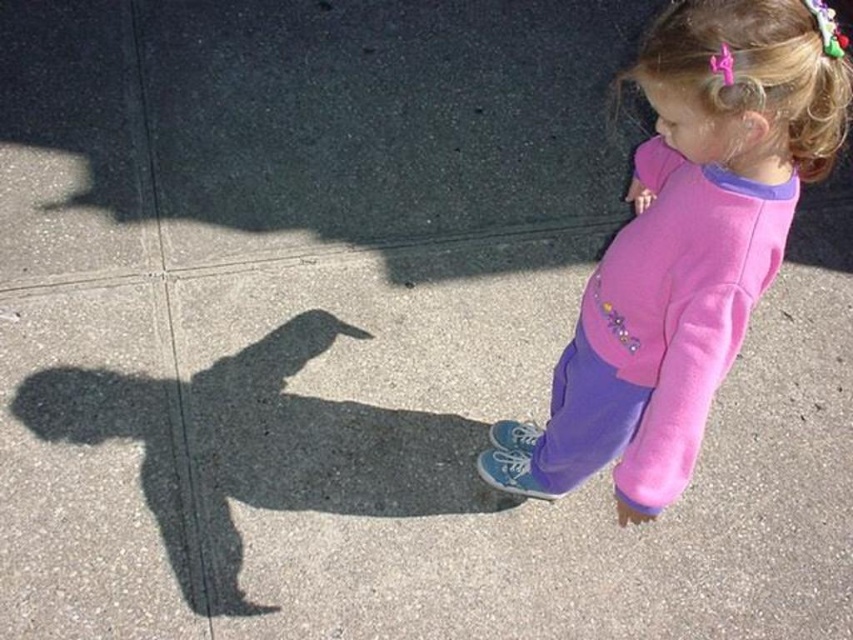
Can you confirm if pink fleece sweatshirt at center is thinner than pink hair clip at upper right?

In fact, pink fleece sweatshirt at center might be wider than pink hair clip at upper right.

Can you confirm if pink fleece sweatshirt at center is wider than pink hair clip at upper right?

Correct, the width of pink fleece sweatshirt at center exceeds that of pink hair clip at upper right.

Find the location of a particular element. This screenshot has height=640, width=853. pink fleece sweatshirt at center is located at coordinates (674, 259).

The image size is (853, 640). Find the location of `pink fleece sweatshirt at center`. pink fleece sweatshirt at center is located at coordinates (674, 259).